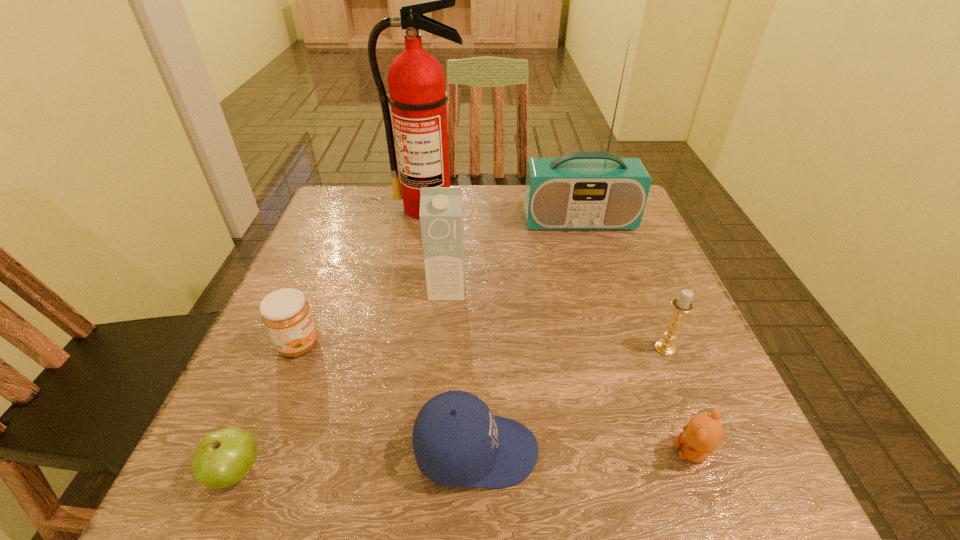
Where is `radio receiver that is at the far edge`? The width and height of the screenshot is (960, 540). radio receiver that is at the far edge is located at coordinates (580, 190).

Where is `cap that is at the near edge`? The image size is (960, 540). cap that is at the near edge is located at coordinates (457, 441).

The width and height of the screenshot is (960, 540). Identify the location of teddy bear that is at the near edge. (703, 434).

Locate an element on the screen. apple present at the near edge is located at coordinates (224, 457).

Where is `jam located at the left edge`? Image resolution: width=960 pixels, height=540 pixels. jam located at the left edge is located at coordinates (286, 314).

You are a GUI agent. You are given a task and a screenshot of the screen. Output one action in this format:
    pyautogui.click(x=<x>, y=<y>)
    Task: Click on the apple that is at the left edge
    The image size is (960, 540).
    Given the screenshot: What is the action you would take?
    pyautogui.click(x=224, y=457)

The image size is (960, 540). I want to click on radio receiver at the right edge, so click(580, 190).

The width and height of the screenshot is (960, 540). Identify the location of candle holder positioned at the right edge. (682, 305).

Find the location of a particular element. teddy bear that is positioned at the right edge is located at coordinates tap(703, 434).

The image size is (960, 540). I want to click on object situated at the near left corner, so click(224, 457).